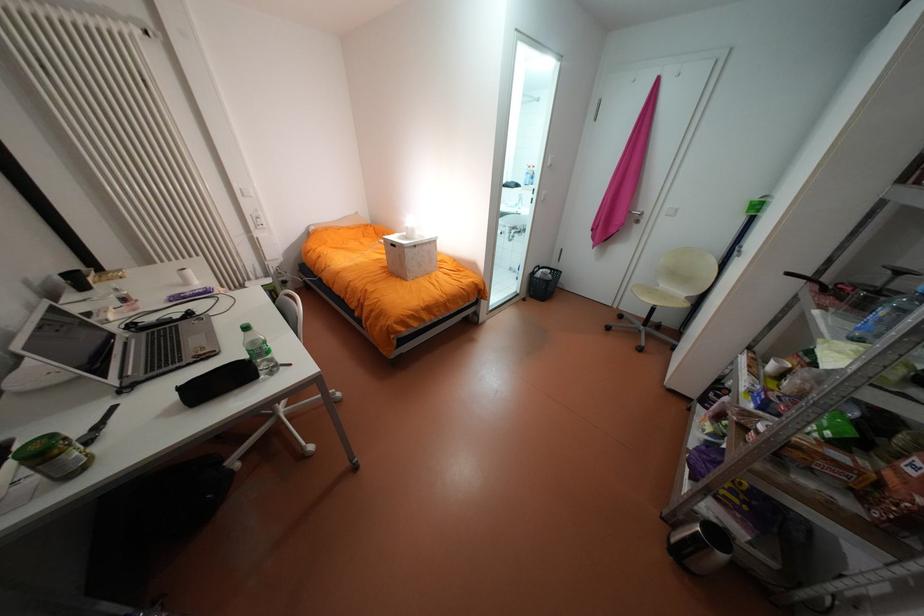
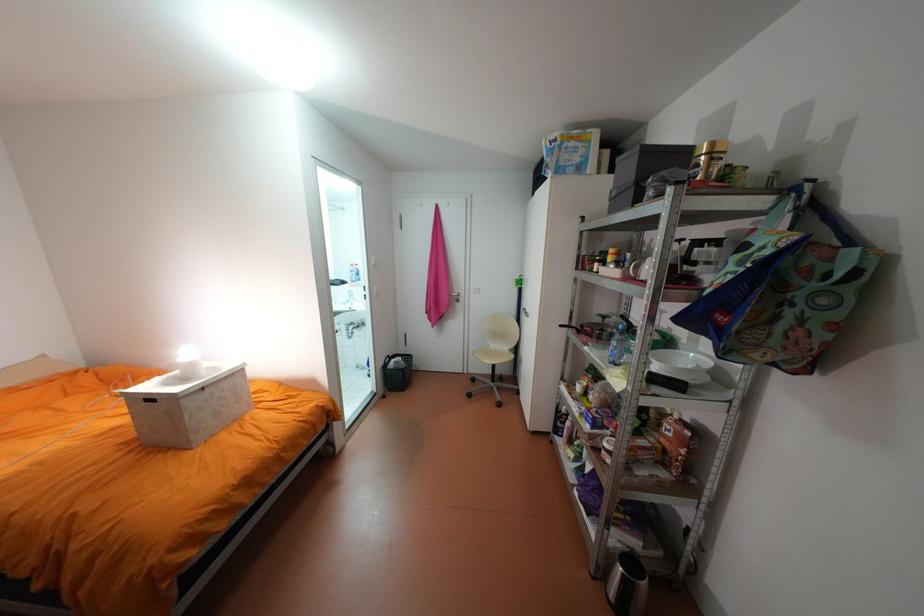
Find the pixel in the second image that matches [395,253] in the first image.

(143, 411)